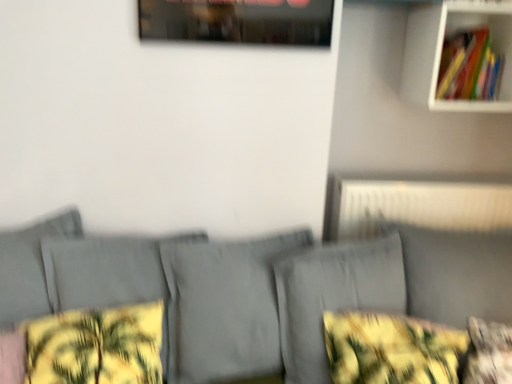
This screenshot has height=384, width=512. What do you see at coordinates (253, 289) in the screenshot?
I see `gray fabric couch at center` at bounding box center [253, 289].

I want to click on white textured radiator at upper right, so click(x=418, y=206).

You are a GUI agent. You are given a task and a screenshot of the screen. Output one action in this format:
    pyautogui.click(x=<x>, y=<y>)
    Task: Click on the yellow floral fabric pillow at lower left, marked as the second pillow in a right-to-left arrangement
    The width and height of the screenshot is (512, 384).
    Given the screenshot: What is the action you would take?
    pyautogui.click(x=96, y=346)

Describe the element at coordinates (96, 346) in the screenshot. I see `yellow floral fabric pillow at lower left, marked as the second pillow in a right-to-left arrangement` at that location.

Describe the element at coordinates (469, 67) in the screenshot. The height and width of the screenshot is (384, 512). I see `hardcover books at upper right` at that location.

What is the approximate width of white matte shelf at upper right?

white matte shelf at upper right is 31.84 centimeters in width.

The image size is (512, 384). Describe the element at coordinates (441, 50) in the screenshot. I see `white matte shelf at upper right` at that location.

What is the approximate height of yellow floral fabric pillow at lower right, arranged as the 2th pillow when viewed from the left?

The height of yellow floral fabric pillow at lower right, arranged as the 2th pillow when viewed from the left, is 14.21 inches.

What are the coordinates of `yellow floral fabric at lower right` in the screenshot? It's located at (391, 349).

From a real-world perspective, is gray fabric couch at center located higher than white textured radiator at upper right?

No, from a real-world perspective, gray fabric couch at center is not over white textured radiator at upper right

Would you consider gray fabric couch at center to be distant from white textured radiator at upper right?

They are positioned close to each other.

How far apart are gray fabric couch at center and white textured radiator at upper right?

16.12 inches.

Would you say white textured radiator at upper right is part of gray fabric couch at center's contents?

No, gray fabric couch at center does not contain white textured radiator at upper right.

Between white textured radiator at upper right and hardcover books at upper right, which one appears on the right side from the viewer's perspective?

hardcover books at upper right.

From the image's perspective, is white textured radiator at upper right beneath hardcover books at upper right?

Indeed, from the image's perspective, white textured radiator at upper right is shown beneath hardcover books at upper right.

Between point (371, 185) and point (442, 66), which one is positioned behind?

Point (371, 185)

Looking at this image, from a real-world perspective, is white textured radiator at upper right physically located above or below hardcover books at upper right?

In terms of real-world spatial position, white textured radiator at upper right is below hardcover books at upper right.

From the image's perspective, which is below, hardcover books at upper right or white textured radiator at upper right?

white textured radiator at upper right is shown below in the image.

Find the location of a particular element. radiator below the hardcover books at upper right (from a real-world perspective) is located at coordinates (418, 206).

Is point (477, 73) closer to camera compared to point (347, 232)?

Yes.

How many degrees apart are the facing directions of hardcover books at upper right and white textured radiator at upper right?

The angle between the facing direction of hardcover books at upper right and the facing direction of white textured radiator at upper right is 1.13 degrees.

Are yellow floral fabric at lower right and hardcover books at upper right located far from each other?

No, yellow floral fabric at lower right is not far away from hardcover books at upper right.

Which is behind, point (435, 349) or point (468, 97)?

The point (468, 97) is farther.

From the image's perspective, between yellow floral fabric at lower right and hardcover books at upper right, which one is located above?

hardcover books at upper right appears higher in the image.

This screenshot has width=512, height=384. Find the location of `book that is behind the yellow floral fabric at lower right`. book that is behind the yellow floral fabric at lower right is located at coordinates (469, 67).

Based on the photo, which point is more forward, (140, 282) or (484, 328)?

The point (484, 328) is more forward.

Is gray fabric couch at center inside or outside of yellow floral fabric pillow at lower right, acting as the first pillow starting from the right?

gray fabric couch at center is located beyond the bounds of yellow floral fabric pillow at lower right, acting as the first pillow starting from the right.

Is gray fabric couch at center next to yellow floral fabric pillow at lower right, acting as the first pillow starting from the right?

There is a gap between gray fabric couch at center and yellow floral fabric pillow at lower right, acting as the first pillow starting from the right.

Does point (321, 351) come farther from viewer compared to point (146, 334)?

Yes, it is.

Is gray fabric couch at center wider or thinner than yellow floral fabric pillow at lower left, marked as the second pillow in a right-to-left arrangement?

Considering their sizes, gray fabric couch at center looks broader than yellow floral fabric pillow at lower left, marked as the second pillow in a right-to-left arrangement.

Is gray fabric couch at center situated inside yellow floral fabric pillow at lower left, marked as the second pillow in a right-to-left arrangement, or outside?

gray fabric couch at center is outside yellow floral fabric pillow at lower left, marked as the second pillow in a right-to-left arrangement.

Considering the relative sizes of gray fabric couch at center and yellow floral fabric pillow at lower left, positioned as the 1th pillow in left-to-right order, in the image provided, is gray fabric couch at center shorter than yellow floral fabric pillow at lower left, positioned as the 1th pillow in left-to-right order,?

In fact, gray fabric couch at center may be taller than yellow floral fabric pillow at lower left, positioned as the 1th pillow in left-to-right order.

Does yellow floral fabric pillow at lower left, marked as the second pillow in a right-to-left arrangement, come in front of yellow floral fabric pillow at lower right, arranged as the 2th pillow when viewed from the left?

Yes, yellow floral fabric pillow at lower left, marked as the second pillow in a right-to-left arrangement, is in front of yellow floral fabric pillow at lower right, arranged as the 2th pillow when viewed from the left.

How much distance is there between yellow floral fabric pillow at lower left, positioned as the 1th pillow in left-to-right order, and yellow floral fabric pillow at lower right, arranged as the 2th pillow when viewed from the left?

yellow floral fabric pillow at lower left, positioned as the 1th pillow in left-to-right order, and yellow floral fabric pillow at lower right, arranged as the 2th pillow when viewed from the left, are 3.59 feet apart.

Considering the sizes of yellow floral fabric pillow at lower left, positioned as the 1th pillow in left-to-right order, and yellow floral fabric pillow at lower right, arranged as the 2th pillow when viewed from the left, in the image, is yellow floral fabric pillow at lower left, positioned as the 1th pillow in left-to-right order, bigger or smaller than yellow floral fabric pillow at lower right, arranged as the 2th pillow when viewed from the left,?

In the image, yellow floral fabric pillow at lower left, positioned as the 1th pillow in left-to-right order, appears to be larger than yellow floral fabric pillow at lower right, arranged as the 2th pillow when viewed from the left.

From the image's perspective, is yellow floral fabric pillow at lower left, positioned as the 1th pillow in left-to-right order, positioned above or below yellow floral fabric pillow at lower right, acting as the first pillow starting from the right?

From the image's perspective, yellow floral fabric pillow at lower left, positioned as the 1th pillow in left-to-right order, appears above yellow floral fabric pillow at lower right, acting as the first pillow starting from the right.

Locate an element on the screen. radiator above the gray fabric couch at center (from a real-world perspective) is located at coordinates (418, 206).

The image size is (512, 384). I want to click on book in front of the white textured radiator at upper right, so click(469, 67).

Consider the image. Considering their positions, is yellow floral fabric pillow at lower left, positioned as the 1th pillow in left-to-right order, positioned further to white matte shelf at upper right than gray fabric couch at center?

Based on the image, yellow floral fabric pillow at lower left, positioned as the 1th pillow in left-to-right order, appears to be further to white matte shelf at upper right.

Estimate the real-world distances between objects in this image. Which object is closer to white matte shelf at upper right, gray fabric couch at center or yellow floral fabric pillow at lower left, marked as the second pillow in a right-to-left arrangement?

The object closer to white matte shelf at upper right is gray fabric couch at center.

Estimate the real-world distances between objects in this image. Which object is closer to white matte shelf at upper right, hardcover books at upper right or white textured radiator at upper right?

hardcover books at upper right lies closer to white matte shelf at upper right than the other object.

Which object lies further to the anchor point gray fabric couch at center, yellow floral fabric at lower right or white matte shelf at upper right?

white matte shelf at upper right is positioned further to the anchor gray fabric couch at center.

Looking at the image, which one is located further to gray fabric couch at center, yellow floral fabric pillow at lower right, acting as the first pillow starting from the right, or hardcover books at upper right?

hardcover books at upper right lies further to gray fabric couch at center than the other object.

Based on their spatial positions, is gray fabric couch at center or hardcover books at upper right closer to yellow floral fabric pillow at lower right, acting as the first pillow starting from the right?

gray fabric couch at center.

From the image, which object appears to be nearer to white textured radiator at upper right, gray fabric couch at center or yellow floral fabric pillow at lower right, arranged as the 2th pillow when viewed from the left?

gray fabric couch at center is closer to white textured radiator at upper right.

Looking at the image, which one is located closer to gray fabric couch at center, hardcover books at upper right or yellow floral fabric at lower right?

yellow floral fabric at lower right is positioned closer to the anchor gray fabric couch at center.

I want to click on radiator situated between gray fabric couch at center and hardcover books at upper right from left to right, so tap(418, 206).

Image resolution: width=512 pixels, height=384 pixels. Identify the location of couch between yellow floral fabric pillow at lower left, marked as the second pillow in a right-to-left arrangement, and white textured radiator at upper right, in the horizontal direction. (253, 289).

At what (x,y) coordinates should I click in order to perform the action: click on pillow between yellow floral fabric at lower right and white textured radiator at upper right in the front-back direction. Please return your answer as a coordinate pair (x, y). Looking at the image, I should click on (488, 353).

I want to click on couch between yellow floral fabric pillow at lower left, positioned as the 1th pillow in left-to-right order, and hardcover books at upper right, in the horizontal direction, so click(253, 289).